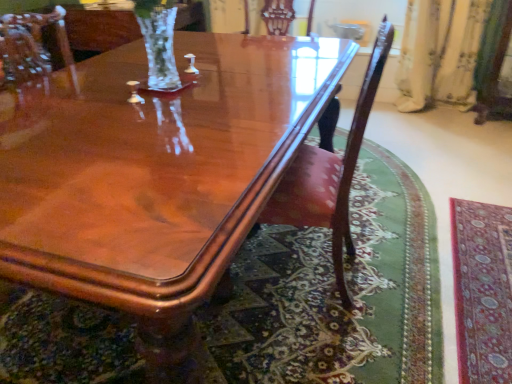
Question: Considering the positions of glossy wood coffee table at center and carpet with intricate patterns at lower right in the image, is glossy wood coffee table at center bigger or smaller than carpet with intricate patterns at lower right?

Choices:
 (A) small
 (B) big

Answer: (B)

Question: From the image's perspective, is glossy wood coffee table at center located above or below carpet with intricate patterns at lower right?

Choices:
 (A) above
 (B) below

Answer: (A)

Question: Based on their relative distances, which object is nearer to the mahogany wood chair at center?

Choices:
 (A) carpet with intricate patterns at lower right
 (B) glossy wood coffee table at center

Answer: (B)

Question: Which is nearer to the carpet with intricate patterns at lower right?

Choices:
 (A) glossy wood coffee table at center
 (B) mahogany wood chair at center

Answer: (B)